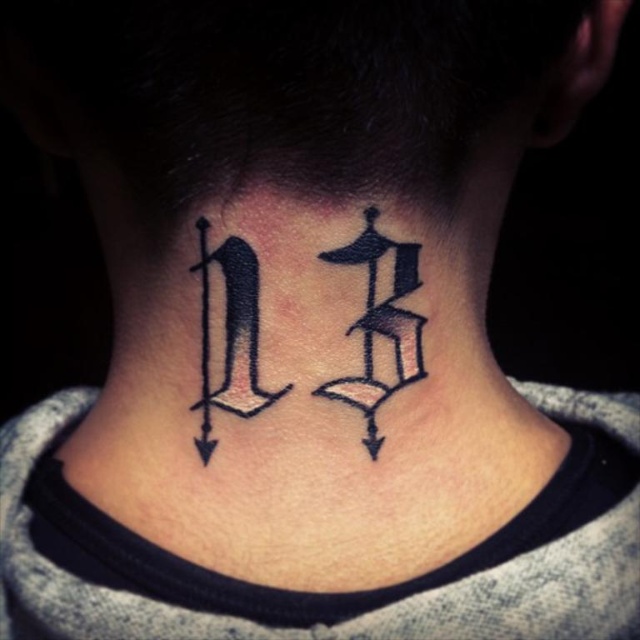
You are a photographer taking a closeup shot of the tattoo on the back of a person. You want to focus on the point at point (202, 225). The camera has a depth of field that can clearly capture objects within 14 inches. Will the point be in focus?

The point (202, 225) is 15.10 inches from the camera, which is beyond the 14 inch depth of field range. Therefore, the point will not be in focus.

You are a tattoo artist assessing the placement of the black ink tattoo at center and the black ink letter d at center on a client. Which one has a greater width?

The black ink tattoo at center has a greater width than the black ink letter d at center.

You are a tattoo artist reviewing a client who has a black ink tattoo at center and a black ink letter d at center. The client wants to ensure the tattoo at center is proportionate to the letter d. Based on the description, which one is shorter?

The black ink tattoo at center is shorter than the black ink letter d at center.